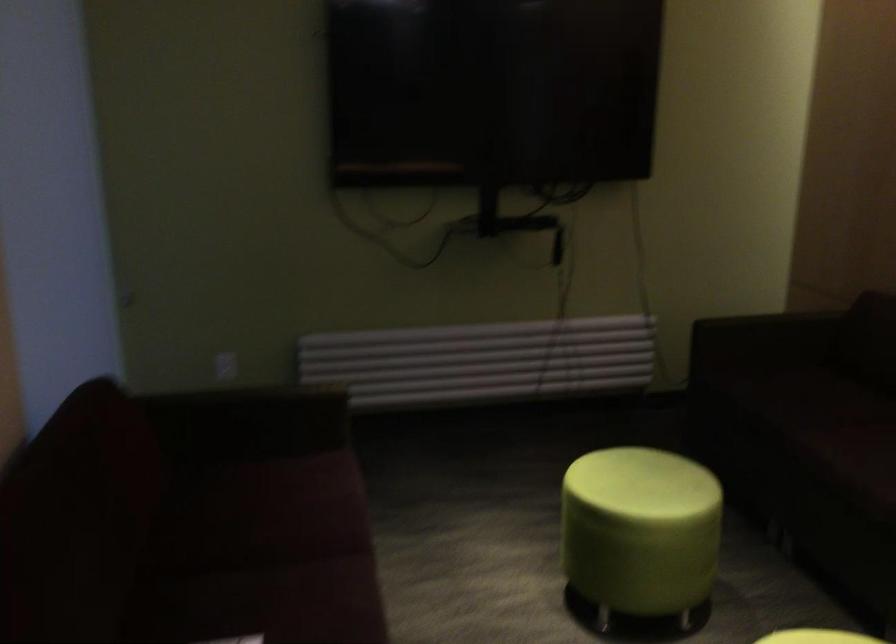
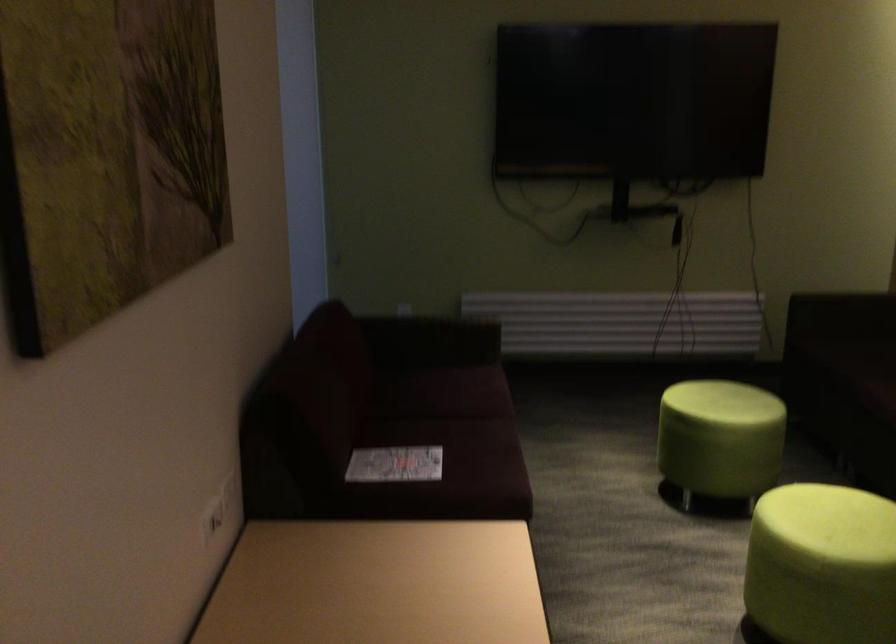
Find the pixel in the second image that matches (633,538) in the first image.

(719, 439)